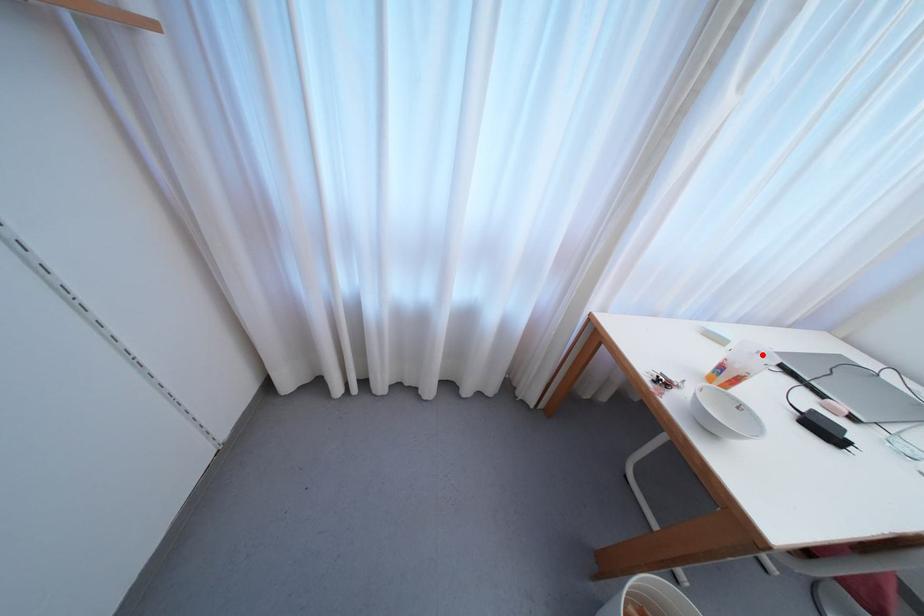
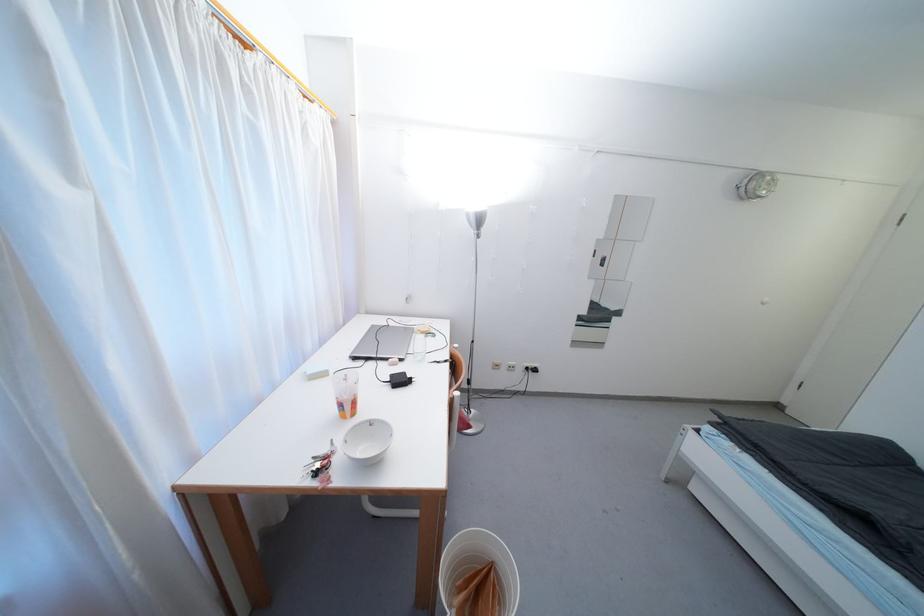
Question: A red point is marked in image1. In image2, is the corresponding 3D point closer to the camera or farther? Reply with the corresponding letter.

Choices:
 (A) The corresponding 3D point is closer.
 (B) The corresponding 3D point is farther.

Answer: (A)